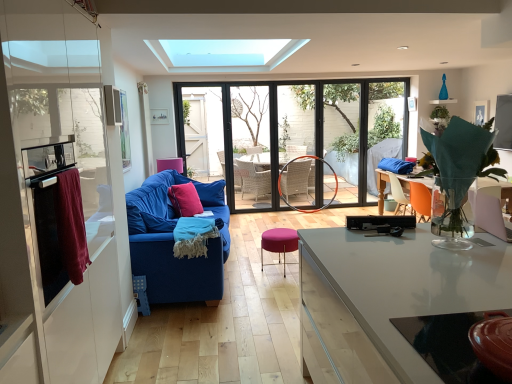
Question: From a real-world perspective, is purple fabric stool at center on top of pink velvet throw pillow at center?

Choices:
 (A) yes
 (B) no

Answer: (B)

Question: Does purple fabric stool at center have a lesser width compared to pink velvet throw pillow at center?

Choices:
 (A) no
 (B) yes

Answer: (A)

Question: From the image's perspective, is purple fabric stool at center above pink velvet throw pillow at center?

Choices:
 (A) no
 (B) yes

Answer: (A)

Question: Is purple fabric stool at center completely or partially outside of pink velvet throw pillow at center?

Choices:
 (A) yes
 (B) no

Answer: (A)

Question: Is purple fabric stool at center at the right side of pink velvet throw pillow at center?

Choices:
 (A) yes
 (B) no

Answer: (A)

Question: Would you say blue textured blanket at center is to the left or to the right of orange plastic chair at right in the picture?

Choices:
 (A) left
 (B) right

Answer: (A)

Question: From the image's perspective, is blue textured blanket at center positioned above or below orange plastic chair at right?

Choices:
 (A) below
 (B) above

Answer: (A)

Question: In terms of width, does blue textured blanket at center look wider or thinner when compared to orange plastic chair at right?

Choices:
 (A) wide
 (B) thin

Answer: (A)

Question: In terms of size, does blue textured blanket at center appear bigger or smaller than orange plastic chair at right?

Choices:
 (A) small
 (B) big

Answer: (A)

Question: Considering the positions of point (176, 195) and point (222, 195), is point (176, 195) closer or farther from the camera than point (222, 195)?

Choices:
 (A) farther
 (B) closer

Answer: (B)

Question: Looking at their shapes, would you say pink velvet throw pillow at center is wider or thinner than pink velvet pillow at center?

Choices:
 (A) wide
 (B) thin

Answer: (B)

Question: Is pink velvet throw pillow at center in front of or behind pink velvet pillow at center in the image?

Choices:
 (A) behind
 (B) front

Answer: (B)

Question: Considering the positions of pink velvet throw pillow at center and pink velvet pillow at center in the image, is pink velvet throw pillow at center bigger or smaller than pink velvet pillow at center?

Choices:
 (A) small
 (B) big

Answer: (A)

Question: Looking at the image, does black plastic tv at center, the 2th appliance positioned from the left, seem bigger or smaller compared to orange plastic chair at right?

Choices:
 (A) small
 (B) big

Answer: (A)

Question: From a real-world perspective, is black plastic tv at center, the 2th appliance positioned from the left, positioned above or below orange plastic chair at right?

Choices:
 (A) above
 (B) below

Answer: (A)